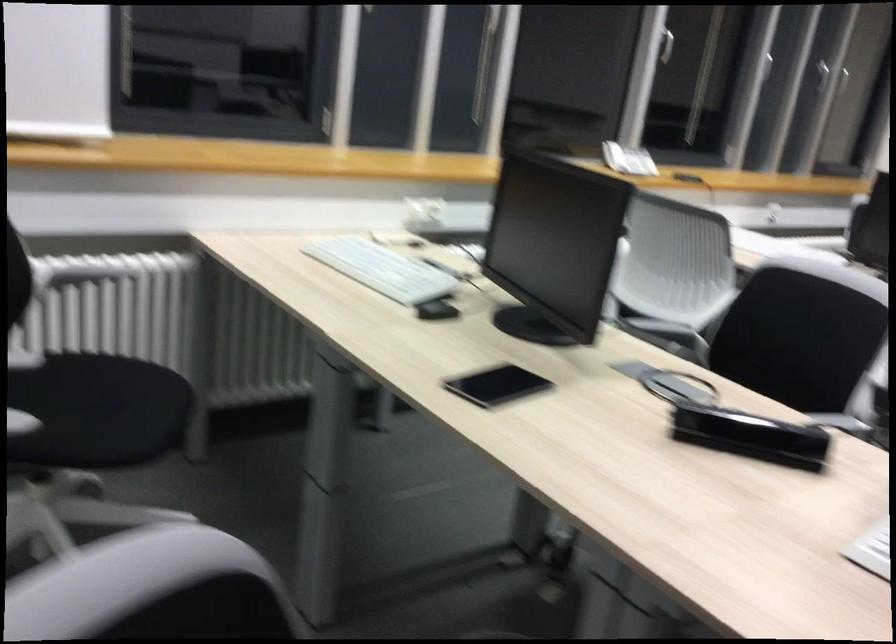
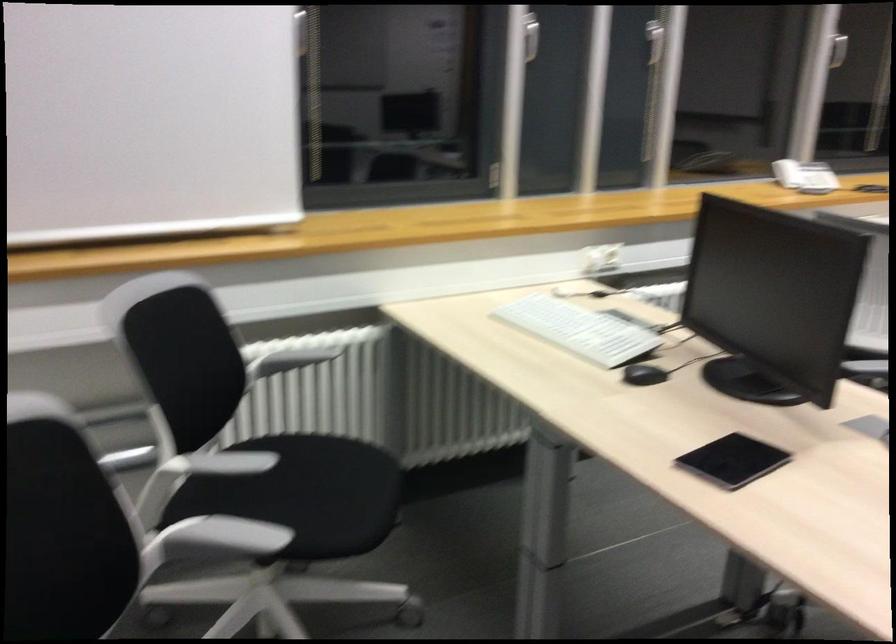
Question: The images are taken continuously from a first-person perspective. In which direction is your viewpoint rotating?

Choices:
 (A) Left
 (B) Right
 (C) Up
 (D) Down

Answer: (A)